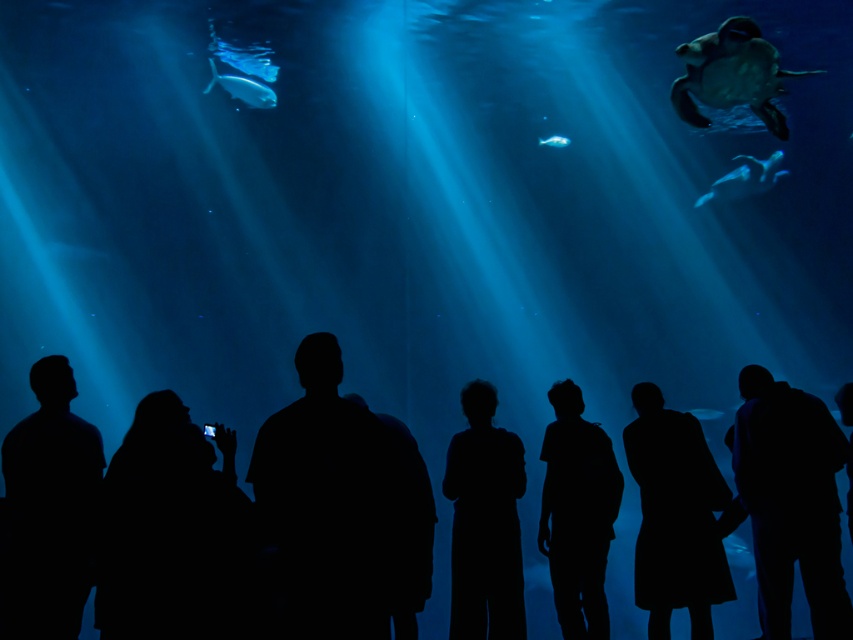
Can you confirm if silhouette figure at center is positioned above black matte shirt at center?

Yes.

The image size is (853, 640). Describe the element at coordinates (485, 522) in the screenshot. I see `silhouette figure at center` at that location.

Is point (457, 458) behind point (555, 467)?

That is False.

You are a GUI agent. You are given a task and a screenshot of the screen. Output one action in this format:
    pyautogui.click(x=<x>, y=<y>)
    Task: Click on the silhouette figure at center
    
    Given the screenshot: What is the action you would take?
    pyautogui.click(x=485, y=522)

Who is positioned more to the left, black matte person at left or translucent blue fish at upper right?

black matte person at left is more to the left.

Which is more to the right, black matte person at left or translucent blue fish at upper right?

translucent blue fish at upper right

Between point (10, 436) and point (757, 157), which one is positioned behind?

Point (757, 157)

Where is `black matte person at left`? The image size is (853, 640). black matte person at left is located at coordinates (50, 508).

Can you confirm if black matte jacket at lower right is positioned above translucent blue fish at center?

No, black matte jacket at lower right is not above translucent blue fish at center.

Who is taller, black matte jacket at lower right or translucent blue fish at center?

black matte jacket at lower right

What are the coordinates of `black matte jacket at lower right` in the screenshot? It's located at (791, 502).

The image size is (853, 640). Find the location of `black matte jacket at lower right`. black matte jacket at lower right is located at coordinates pos(791,502).